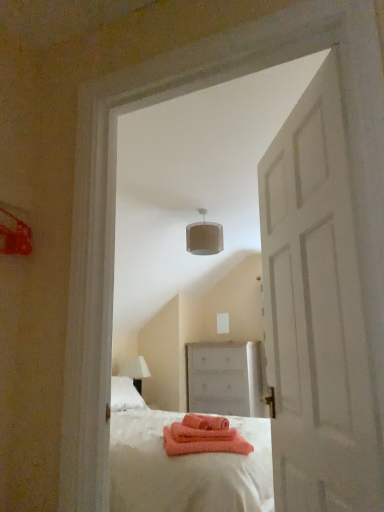
This screenshot has height=512, width=384. Describe the element at coordinates (204, 237) in the screenshot. I see `white textured lampshade at upper center` at that location.

This screenshot has height=512, width=384. Identify the location of white matte chest of drawers at center. (225, 379).

In order to face white matte chest of drawers at center, should I rotate leftwards or rightwards?

To align with it, rotate right about 4.831°.

The image size is (384, 512). I want to click on white matte door at center, so click(316, 313).

Identify the location of white fabric lampshade at left. The width and height of the screenshot is (384, 512). (135, 371).

I want to click on white textured lampshade at upper center, so click(x=204, y=237).

From a real-world perspective, does white matte door at center stand above white textured lampshade at upper center?

No, from a real-world perspective, white matte door at center is not on top of white textured lampshade at upper center.

Does point (346, 424) lie behind point (208, 236)?

No.

Which object is wider, white matte door at center or white textured lampshade at upper center?

With larger width is white textured lampshade at upper center.

Is white fabric lampshade at left completely or partially outside of white textured lampshade at upper center?

white fabric lampshade at left is positioned outside white textured lampshade at upper center.

From the image's perspective, which one is positioned lower, white fabric lampshade at left or white textured lampshade at upper center?

white fabric lampshade at left is shown below in the image.

From a real-world perspective, is white fabric lampshade at left over white textured lampshade at upper center?

No.

Between white fabric lampshade at left and white textured lampshade at upper center, which one is positioned in front?

white textured lampshade at upper center is closer to the camera.

Do you think white matte chest of drawers at center is within white textured lampshade at upper center, or outside of it?

white matte chest of drawers at center is not inside white textured lampshade at upper center, it's outside.

Looking at this image, visually, is white matte chest of drawers at center positioned to the left or to the right of white textured lampshade at upper center?

Clearly, white matte chest of drawers at center is on the right of white textured lampshade at upper center in the image.

Identify the location of the chest of drawers directly beneath the white textured lampshade at upper center (from a real-world perspective). (225, 379).

From a real-world perspective, is white matte chest of drawers at center above or below white textured lampshade at upper center?

From a real-world perspective, white matte chest of drawers at center is physically below white textured lampshade at upper center.

Who is bigger, white matte door at center or white matte chest of drawers at center?

With larger size is white matte chest of drawers at center.

From a real-world perspective, who is located higher, white matte door at center or white matte chest of drawers at center?

In real-world perspective, white matte door at center is above.

In the scene shown: Does white matte door at center have a lesser height compared to white matte chest of drawers at center?

Incorrect, the height of white matte door at center does not fall short of that of white matte chest of drawers at center.

What's the angular difference between white matte door at center and white matte chest of drawers at center's facing directions?

The facing directions of white matte door at center and white matte chest of drawers at center are 55.6 degrees apart.

Considering the sizes of white matte chest of drawers at center and white matte door at center in the image, is white matte chest of drawers at center taller or shorter than white matte door at center?

In the image, white matte chest of drawers at center appears to be shorter than white matte door at center.

Is white matte chest of drawers at center in front of or behind white matte door at center in the image?

In the image, white matte chest of drawers at center appears behind white matte door at center.

Considering the sizes of objects white matte chest of drawers at center and white matte door at center in the image provided, who is smaller, white matte chest of drawers at center or white matte door at center?

Smaller between the two is white matte door at center.

From the image's perspective, who appears lower, white matte chest of drawers at center or white matte door at center?

white matte chest of drawers at center, from the image's perspective.

Can you tell me how much white fabric lampshade at left and white matte door at center differ in facing direction?

146 degrees separate the facing orientations of white fabric lampshade at left and white matte door at center.

From a real-world perspective, is white fabric lampshade at left located higher than white matte door at center?

Actually, white fabric lampshade at left is physically below white matte door at center in the real world.

Is white fabric lampshade at left positioned before white matte door at center?

No, the depth of white fabric lampshade at left is greater than that of white matte door at center.

Does point (322, 328) appear closer or farther from the camera than point (128, 362)?

Point (322, 328).

Between white matte door at center and white fabric lampshade at left, which one is positioned in front?

white matte door at center is in front.

Considering the sizes of objects white matte door at center and white fabric lampshade at left in the image provided, who is smaller, white matte door at center or white fabric lampshade at left?

Smaller between the two is white fabric lampshade at left.

The image size is (384, 512). In the image, there is a white textured lampshade at upper center. Identify the location of door below it (from a real-world perspective). click(x=316, y=313).

You are a GUI agent. You are given a task and a screenshot of the screen. Output one action in this format:
    pyautogui.click(x=<x>, y=<y>)
    Task: Click on the lamp that is above the white fabric lampshade at left (from a real-world perspective)
    This screenshot has height=512, width=384.
    Given the screenshot: What is the action you would take?
    pyautogui.click(x=204, y=237)

Looking at the image, which one is located further to white matte door at center, white fabric lampshade at left or white textured lampshade at upper center?

white fabric lampshade at left lies further to white matte door at center than the other object.

Estimate the real-world distances between objects in this image. Which object is closer to white matte chest of drawers at center, white matte door at center or white fabric lampshade at left?

white fabric lampshade at left lies closer to white matte chest of drawers at center than the other object.

Estimate the real-world distances between objects in this image. Which object is closer to white textured lampshade at upper center, white matte chest of drawers at center or white fabric lampshade at left?

white matte chest of drawers at center lies closer to white textured lampshade at upper center than the other object.

Based on their spatial positions, is white matte chest of drawers at center or white fabric lampshade at left further from white matte door at center?

white fabric lampshade at left is positioned further to the anchor white matte door at center.

Based on their spatial positions, is white matte door at center or white fabric lampshade at left further from white textured lampshade at upper center?

The object further to white textured lampshade at upper center is white matte door at center.

Which object lies nearer to the anchor point white matte door at center, white fabric lampshade at left or white matte chest of drawers at center?

white matte chest of drawers at center.

Which object lies nearer to the anchor point white textured lampshade at upper center, white matte chest of drawers at center or white matte door at center?

Based on the image, white matte chest of drawers at center appears to be nearer to white textured lampshade at upper center.

Based on their spatial positions, is white matte chest of drawers at center or white textured lampshade at upper center further from white matte door at center?

Among the two, white matte chest of drawers at center is located further to white matte door at center.

The image size is (384, 512). I want to click on table lamp between white matte door at center and white matte chest of drawers at center from front to back, so click(x=135, y=371).

The image size is (384, 512). Find the location of `lamp between white matte door at center and white matte chest of drawers at center in the front-back direction`. lamp between white matte door at center and white matte chest of drawers at center in the front-back direction is located at coordinates pyautogui.click(x=204, y=237).

Where is `table lamp between white textured lampshade at upper center and white matte chest of drawers at center vertically`? table lamp between white textured lampshade at upper center and white matte chest of drawers at center vertically is located at coordinates (135, 371).

Where is `lamp between white matte door at center and white fabric lampshade at left along the z-axis`? The height and width of the screenshot is (512, 384). lamp between white matte door at center and white fabric lampshade at left along the z-axis is located at coordinates (204, 237).